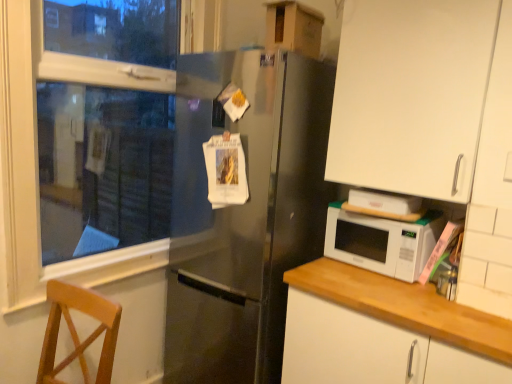
Locate an element on the screen. The image size is (512, 384). satin black refrigerator at center is located at coordinates (245, 216).

Describe the element at coordinates (76, 332) in the screenshot. Image resolution: width=512 pixels, height=384 pixels. I see `wooden chair at lower left` at that location.

Describe the element at coordinates (382, 241) in the screenshot. The image size is (512, 384). I see `white glossy microwave at lower right` at that location.

Identify the location of white matte cabinet at right, the 2th cabinetry in the top-to-bottom sequence. (370, 350).

Describe the element at coordinates (38, 155) in the screenshot. Image resolution: width=512 pixels, height=384 pixels. I see `white plastic window frame at left` at that location.

The width and height of the screenshot is (512, 384). Find the location of `white plastic window frame at left`. white plastic window frame at left is located at coordinates [x=38, y=155].

I want to click on satin black refrigerator at center, so click(x=245, y=216).

Looking at this image, is white plastic window frame at left taller or shorter than white matte cabinet at right, which appears as the 1th cabinetry when ordered from the bottom?

In the image, white plastic window frame at left appears to be taller than white matte cabinet at right, which appears as the 1th cabinetry when ordered from the bottom.

Which of these two, white plastic window frame at left or white matte cabinet at right, the 2th cabinetry in the top-to-bottom sequence, is bigger?

white matte cabinet at right, the 2th cabinetry in the top-to-bottom sequence.

This screenshot has height=384, width=512. What are the coordinates of `cabinetry that is the 1st object to the right of the white plastic window frame at left, starting at the anchor` in the screenshot? It's located at (370, 350).

Does white glossy microwave at lower right turn towards white matte cabinet at right, which appears as the 1th cabinetry when ordered from the bottom?

No, white glossy microwave at lower right is not oriented towards white matte cabinet at right, which appears as the 1th cabinetry when ordered from the bottom.

From a real-world perspective, is white glossy microwave at lower right under white matte cabinet at right, the 2th cabinetry in the top-to-bottom sequence?

No, from a real-world perspective, white glossy microwave at lower right is not below white matte cabinet at right, the 2th cabinetry in the top-to-bottom sequence.

Do you think white glossy microwave at lower right is within white matte cabinet at right, which appears as the 1th cabinetry when ordered from the bottom, or outside of it?

white glossy microwave at lower right cannot be found inside white matte cabinet at right, which appears as the 1th cabinetry when ordered from the bottom.

From the image's perspective, does satin black refrigerator at center appear lower than white matte cabinet at upper right, marked as the second cabinetry in a bottom-to-top arrangement?

Yes.

From a real-world perspective, is satin black refrigerator at center positioned over white matte cabinet at upper right, marked as the second cabinetry in a bottom-to-top arrangement, based on gravity?

No, from a real-world perspective, satin black refrigerator at center is not above white matte cabinet at upper right, marked as the second cabinetry in a bottom-to-top arrangement.

This screenshot has width=512, height=384. I want to click on the 1st cabinetry in front of the satin black refrigerator at center, so click(411, 95).

Could you tell me if satin black refrigerator at center is facing white matte cabinet at upper right, the first cabinetry from the top?

No, satin black refrigerator at center is not aimed at white matte cabinet at upper right, the first cabinetry from the top.

Considering the positions of point (21, 294) and point (351, 214), is point (21, 294) closer or farther from the camera than point (351, 214)?

Point (21, 294) appears to be closer to the viewer than point (351, 214).

Which is more to the right, white plastic window frame at left or white glossy microwave at lower right?

A: white glossy microwave at lower right.

From a real-world perspective, which is physically above, white plastic window frame at left or white glossy microwave at lower right?

From a 3D spatial view, white plastic window frame at left is above.

Which is correct: white plastic window frame at left is inside white glossy microwave at lower right, or outside of it?

white plastic window frame at left is spatially situated outside white glossy microwave at lower right.

Considering the points (376, 181) and (405, 381), which point is behind, point (376, 181) or point (405, 381)?

Point (376, 181)

Can you confirm if white matte cabinet at upper right, marked as the second cabinetry in a bottom-to-top arrangement, is taller than white matte cabinet at right, the 2th cabinetry in the top-to-bottom sequence?

No.

From the picture: From a real-world perspective, is white matte cabinet at upper right, marked as the second cabinetry in a bottom-to-top arrangement, located higher than white matte cabinet at right, which appears as the 1th cabinetry when ordered from the bottom?

Yes.

From the image's perspective, would you say white matte cabinet at upper right, marked as the second cabinetry in a bottom-to-top arrangement, is shown under white matte cabinet at right, which appears as the 1th cabinetry when ordered from the bottom?

No, from the image's perspective, white matte cabinet at upper right, marked as the second cabinetry in a bottom-to-top arrangement, is not below white matte cabinet at right, which appears as the 1th cabinetry when ordered from the bottom.

Is the surface of white plastic window frame at left in direct contact with white matte cabinet at upper right, marked as the second cabinetry in a bottom-to-top arrangement?

No, white plastic window frame at left is not beside white matte cabinet at upper right, marked as the second cabinetry in a bottom-to-top arrangement.

Is the position of white plastic window frame at left less distant than that of white matte cabinet at upper right, the first cabinetry from the top?

No, the depth of white plastic window frame at left is greater than that of white matte cabinet at upper right, the first cabinetry from the top.

Can you confirm if white plastic window frame at left is bigger than white matte cabinet at upper right, marked as the second cabinetry in a bottom-to-top arrangement?

Correct, white plastic window frame at left is larger in size than white matte cabinet at upper right, marked as the second cabinetry in a bottom-to-top arrangement.

Is point (90, 278) less distant than point (351, 85)?

No, it is behind (351, 85).

Considering the positions of objects white plastic window frame at left and satin black refrigerator at center in the image provided, who is behind, white plastic window frame at left or satin black refrigerator at center?

satin black refrigerator at center is more distant.

From the image's perspective, which is below, white plastic window frame at left or satin black refrigerator at center?

satin black refrigerator at center is shown below in the image.

Would you say white plastic window frame at left is a long distance from satin black refrigerator at center?

No, white plastic window frame at left is not far from satin black refrigerator at center.

This screenshot has width=512, height=384. I want to click on window frame on the left of white matte cabinet at right, the 2th cabinetry in the top-to-bottom sequence, so click(x=38, y=155).

This screenshot has height=384, width=512. Identify the location of microwave oven above the white matte cabinet at right, the 2th cabinetry in the top-to-bottom sequence (from the image's perspective). (382, 241).

When comparing their distances from satin black refrigerator at center, does white matte cabinet at upper right, marked as the second cabinetry in a bottom-to-top arrangement, or white plastic window frame at left seem closer?

white matte cabinet at upper right, marked as the second cabinetry in a bottom-to-top arrangement.

Estimate the real-world distances between objects in this image. Which object is closer to wooden chair at lower left, white matte cabinet at upper right, marked as the second cabinetry in a bottom-to-top arrangement, or satin black refrigerator at center?

satin black refrigerator at center lies closer to wooden chair at lower left than the other object.

When comparing their distances from white plastic window frame at left, does white glossy microwave at lower right or white matte cabinet at right, the 2th cabinetry in the top-to-bottom sequence, seem closer?

white matte cabinet at right, the 2th cabinetry in the top-to-bottom sequence.

Based on their spatial positions, is white plastic window frame at left or white matte cabinet at right, the 2th cabinetry in the top-to-bottom sequence, closer to white glossy microwave at lower right?

white matte cabinet at right, the 2th cabinetry in the top-to-bottom sequence.

Looking at the image, which one is located further to satin black refrigerator at center, white plastic window frame at left or wooden chair at lower left?

wooden chair at lower left.

Based on their spatial positions, is white glossy microwave at lower right or wooden chair at lower left further from white matte cabinet at upper right, the first cabinetry from the top?

The object further to white matte cabinet at upper right, the first cabinetry from the top, is wooden chair at lower left.

Considering their positions, is white plastic window frame at left positioned closer to white matte cabinet at upper right, marked as the second cabinetry in a bottom-to-top arrangement, than white matte cabinet at right, the 2th cabinetry in the top-to-bottom sequence?

The object closer to white matte cabinet at upper right, marked as the second cabinetry in a bottom-to-top arrangement, is white matte cabinet at right, the 2th cabinetry in the top-to-bottom sequence.

From the image, which object appears to be farther from satin black refrigerator at center, white matte cabinet at right, the 2th cabinetry in the top-to-bottom sequence, or white matte cabinet at upper right, the first cabinetry from the top?

Based on the image, white matte cabinet at right, the 2th cabinetry in the top-to-bottom sequence, appears to be further to satin black refrigerator at center.

The height and width of the screenshot is (384, 512). I want to click on microwave oven located between satin black refrigerator at center and white matte cabinet at right, the 2th cabinetry in the top-to-bottom sequence, in the left-right direction, so click(x=382, y=241).

The width and height of the screenshot is (512, 384). What are the coordinates of `microwave oven located between wooden chair at lower left and white matte cabinet at right, which appears as the 1th cabinetry when ordered from the bottom, in the left-right direction` in the screenshot? It's located at (382, 241).

Where is `window frame situated between wooden chair at lower left and white matte cabinet at upper right, the first cabinetry from the top, from left to right`? window frame situated between wooden chair at lower left and white matte cabinet at upper right, the first cabinetry from the top, from left to right is located at coordinates (38, 155).

Find the location of `cabinetry located between white plastic window frame at left and white matte cabinet at upper right, the first cabinetry from the top, in the left-right direction`. cabinetry located between white plastic window frame at left and white matte cabinet at upper right, the first cabinetry from the top, in the left-right direction is located at coordinates (370, 350).